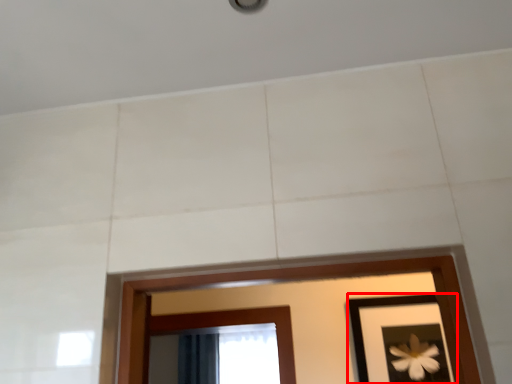
Question: Where is picture frame (annotated by the red box) located in relation to curtain in the image?

Choices:
 (A) left
 (B) right

Answer: (B)